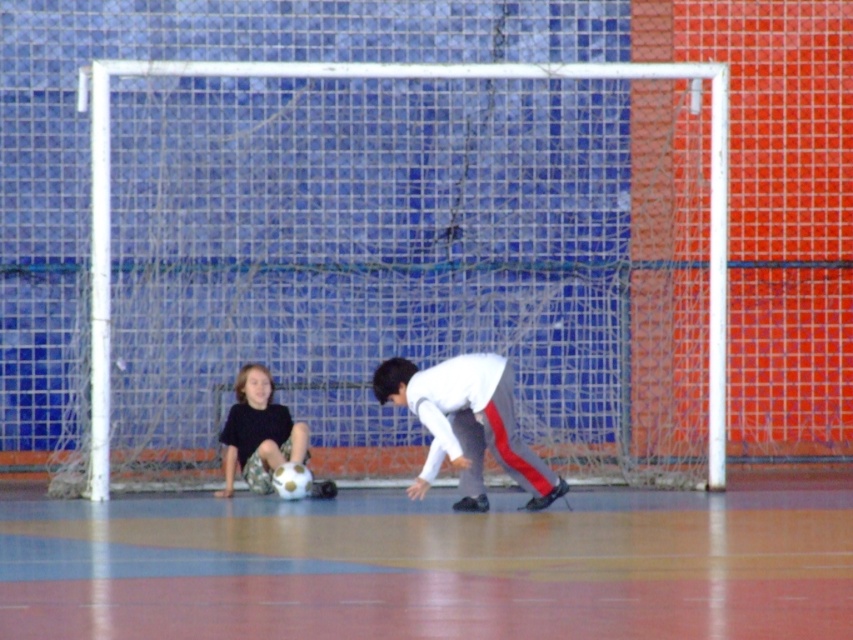
Question: Which of the following is the closest to the observer?

Choices:
 (A) (454, 440)
 (B) (782, 556)

Answer: (B)

Question: Is white mesh netting at center positioned before white matte shirt at center?

Choices:
 (A) no
 (B) yes

Answer: (A)

Question: Can you confirm if brown wooden floor at center is positioned above matte black shirt at lower left?

Choices:
 (A) yes
 (B) no

Answer: (B)

Question: Which point appears farthest from the camera in this image?

Choices:
 (A) (279, 438)
 (B) (416, 616)
 (C) (346, 67)
 (D) (431, 428)

Answer: (A)

Question: Which object is farther from the camera taking this photo?

Choices:
 (A) white mesh netting at center
 (B) brown wooden floor at center
 (C) matte black shirt at lower left
 (D) white matte shirt at center

Answer: (A)

Question: Where is white mesh netting at center located in relation to matte black shirt at lower left in the image?

Choices:
 (A) above
 (B) below

Answer: (A)